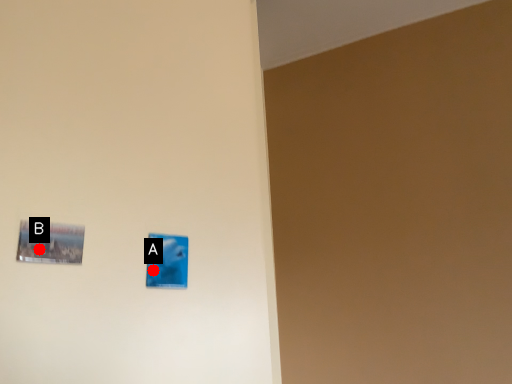
Question: Two points are circled on the image, labeled by A and B beside each circle. Which of the following is the farthest from the observer?

Choices:
 (A) A is further
 (B) B is further

Answer: (A)